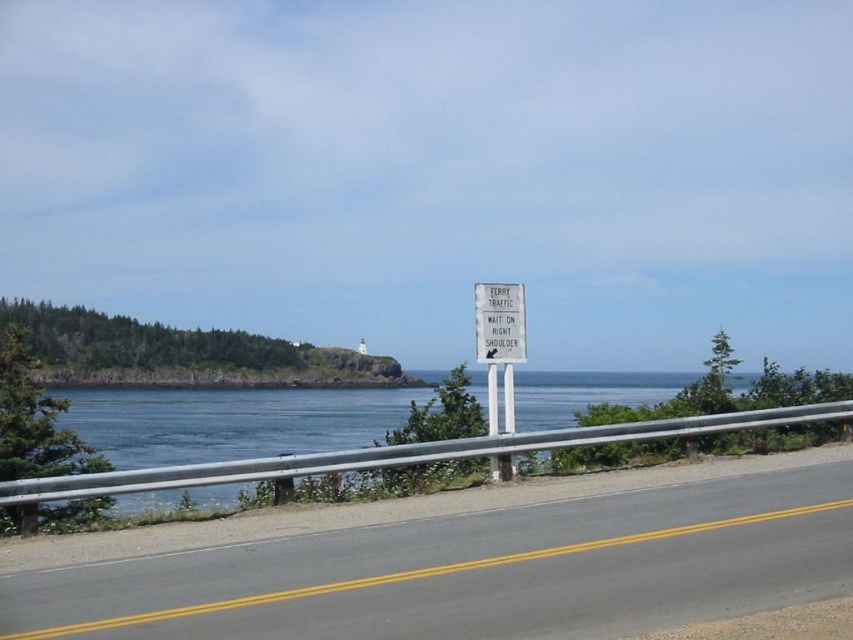
Question: Does gray asphalt road at center have a greater width compared to white plastic sign at center?

Choices:
 (A) no
 (B) yes

Answer: (B)

Question: Considering the relative positions of gray asphalt road at center and white plastic sign at center in the image provided, where is gray asphalt road at center located with respect to white plastic sign at center?

Choices:
 (A) above
 (B) below

Answer: (B)

Question: Can you confirm if gray asphalt road at center is positioned to the right of white plastic sign at center?

Choices:
 (A) yes
 (B) no

Answer: (B)

Question: Which point is farther to the camera?

Choices:
 (A) (482, 593)
 (B) (479, 337)

Answer: (B)

Question: Which point is closer to the camera?

Choices:
 (A) (494, 360)
 (B) (51, 600)

Answer: (B)

Question: Which object is closer to the camera taking this photo?

Choices:
 (A) white plastic sign at center
 (B) gray asphalt road at center

Answer: (B)